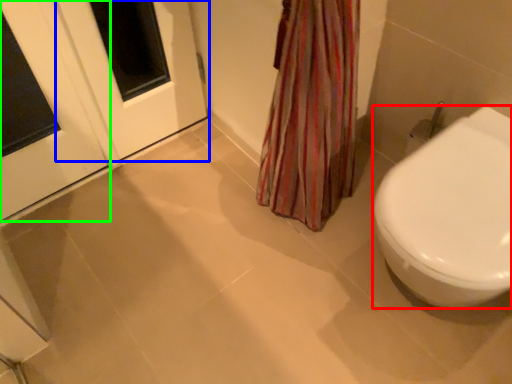
Question: Based on their relative distances, which object is nearer to bidet (highlighted by a red box)? Choose from screen door (highlighted by a blue box) and door (highlighted by a green box).

Choices:
 (A) screen door
 (B) door

Answer: (A)